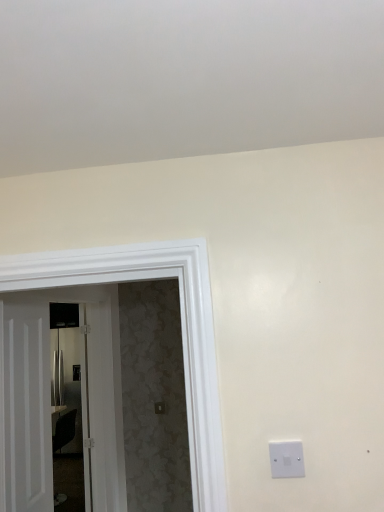
Question: Based on their positions, is white wooden door at left, the second door viewed from the right, located to the left or right of metallic silver refrigerator at left?

Choices:
 (A) right
 (B) left

Answer: (A)

Question: From their relative heights in the image, would you say white wooden door at left, the second door viewed from the right, is taller or shorter than metallic silver refrigerator at left?

Choices:
 (A) short
 (B) tall

Answer: (A)

Question: Which object is the farthest from the white wooden door at left, arranged as the first door when viewed from the left?

Choices:
 (A) metallic silver refrigerator at left
 (B) white plastic light switch at lower right
 (C) white glossy door at left, which appears as the first door when viewed from the right

Answer: (B)

Question: Which object is the closest to the white glossy door at left, acting as the second door starting from the left?

Choices:
 (A) white plastic light switch at lower right
 (B) metallic silver refrigerator at left
 (C) white wooden door at left, the second door viewed from the right

Answer: (B)